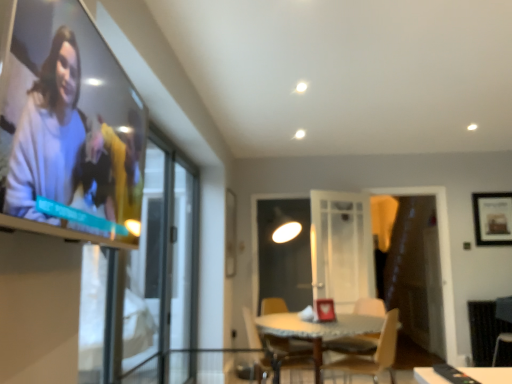
Question: From the image's perspective, is white glossy table at center positioned above or below wooden chair at lower center, the first chair when ordered from left to right?

Choices:
 (A) above
 (B) below

Answer: (A)

Question: From a real-world perspective, relative to wooden chair at lower center, the second chair from the right, is white glossy table at center vertically above or below?

Choices:
 (A) above
 (B) below

Answer: (A)

Question: Based on their relative distances, which object is nearer to the clear glass table at center?

Choices:
 (A) wooden framed picture at upper right
 (B) matte white sweater at upper left
 (C) dark brown leather armchair at lower right
 (D) transparent glass screen door at left, acting as the 1th screen door starting from the front
 (E) wooden chair at center, the second chair positioned from the left

Answer: (E)

Question: Which object is positioned closest to the wooden chair at lower center, the first chair when ordered from left to right?

Choices:
 (A) wooden framed picture at upper right
 (B) white glossy table at center
 (C) dark brown leather armchair at lower right
 (D) transparent glass screen door at left, arranged as the second screen door when viewed from the front
 (E) matte white sweater at upper left

Answer: (D)